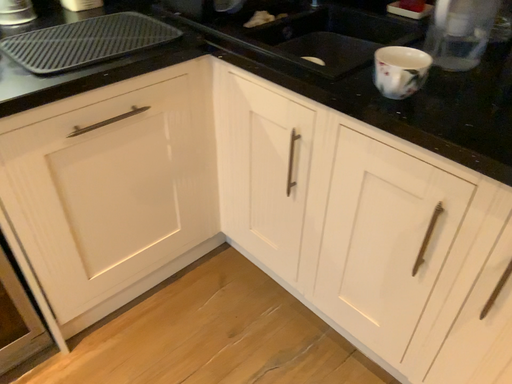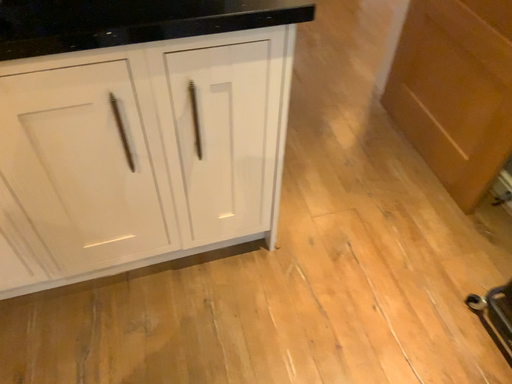
Question: Which way did the camera rotate in the video?

Choices:
 (A) rotated upward
 (B) rotated downward

Answer: (A)